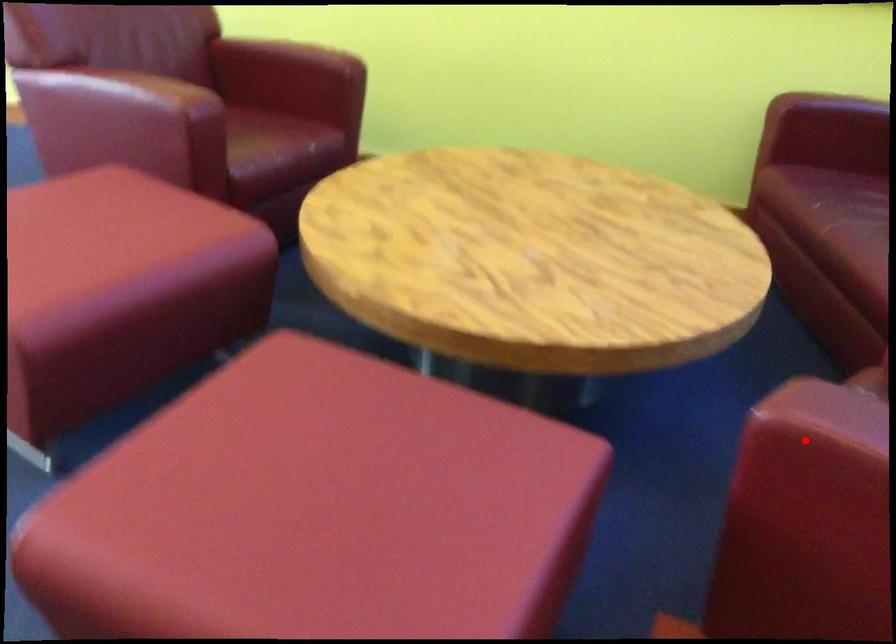
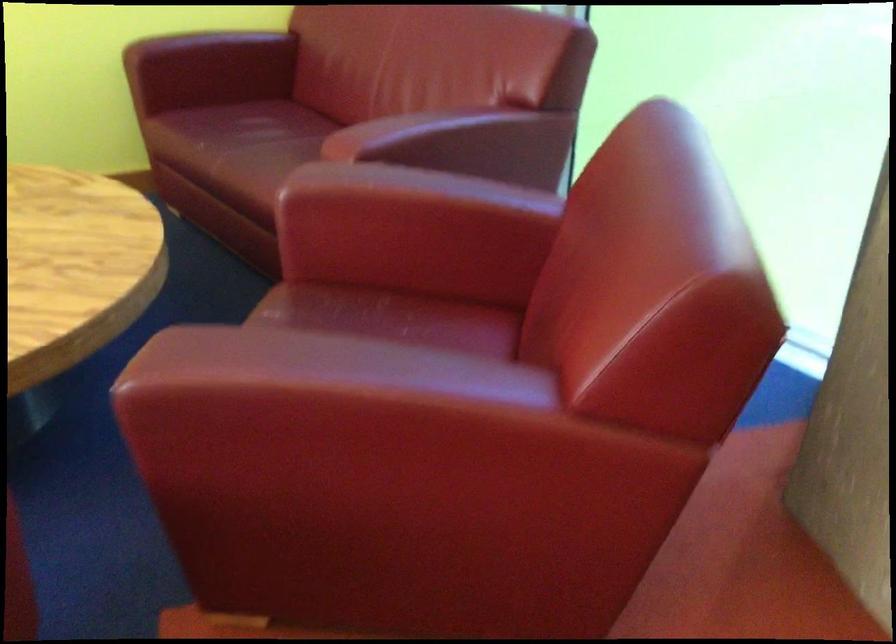
Locate, in the second image, the point that corresponds to the highlighted location in the first image.

(177, 386)